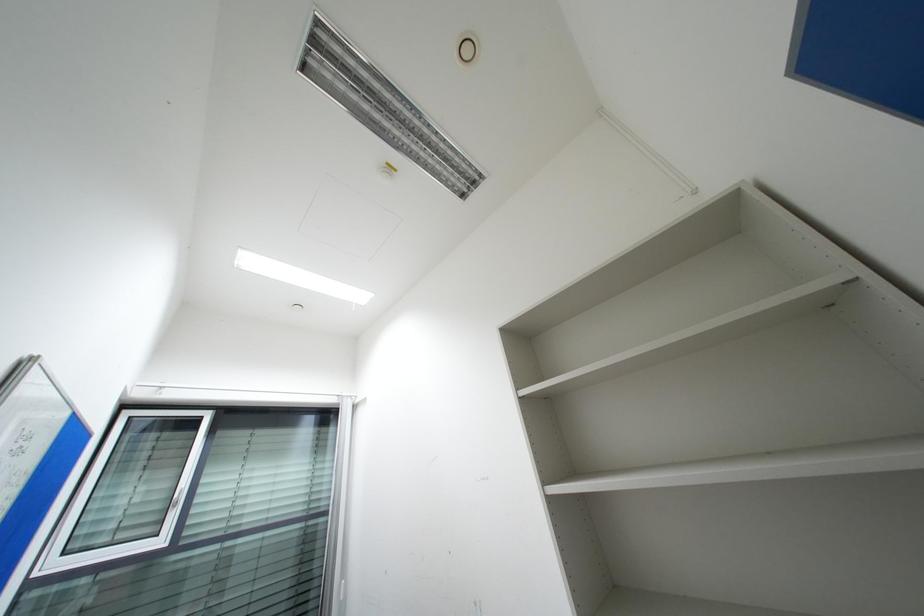
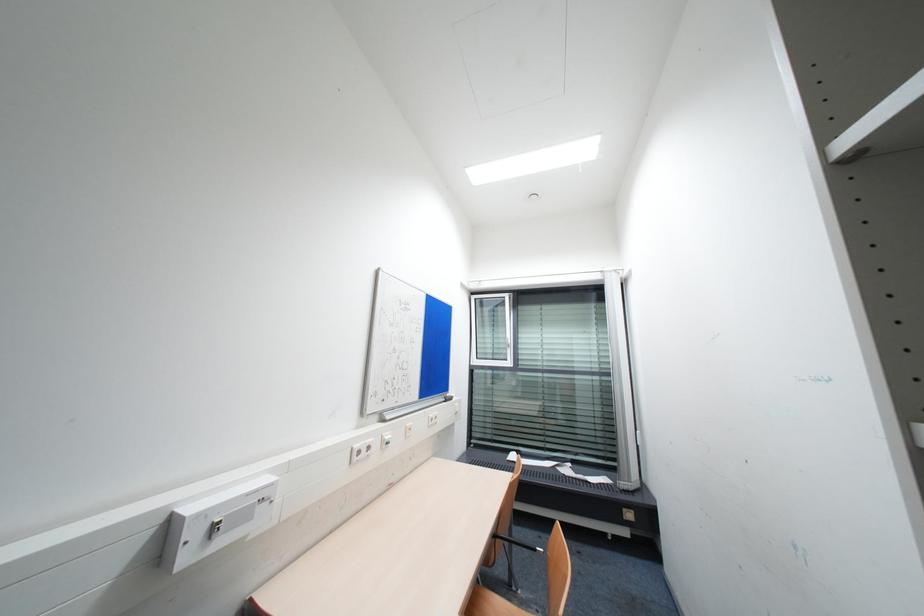
Question: The camera is either moving clockwise (left) or counter-clockwise (right) around the object. The first image is from the beginning of the video and the second image is from the end. Is the camera moving left or right when shooting the video?

Choices:
 (A) Left
 (B) Right

Answer: (B)